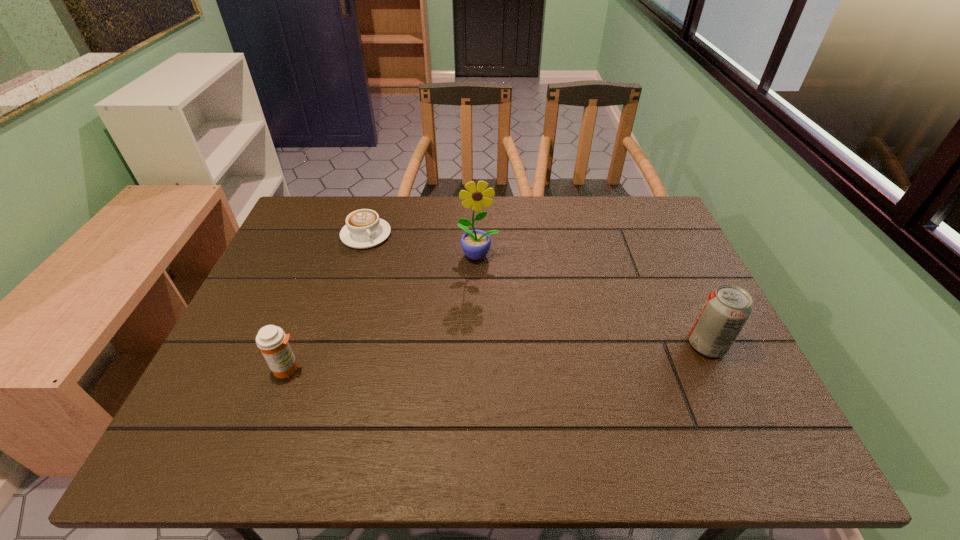
In order to click on vacant region at the near edge in this screenshot , I will do `click(417, 392)`.

You are a GUI agent. You are given a task and a screenshot of the screen. Output one action in this format:
    pyautogui.click(x=<x>, y=<y>)
    Task: Click on the free space at the left edge
    The width and height of the screenshot is (960, 540).
    Given the screenshot: What is the action you would take?
    pyautogui.click(x=289, y=326)

Identify the location of vacant position at the right edge of the desktop. The width and height of the screenshot is (960, 540). (704, 299).

The height and width of the screenshot is (540, 960). I want to click on vacant space at the far left corner of the desktop, so click(x=324, y=206).

Locate an element on the screen. The width and height of the screenshot is (960, 540). free space at the far right corner of the desktop is located at coordinates (617, 213).

I want to click on vacant area that lies between the soda can and the cappuccino, so click(x=537, y=289).

Locate an element on the screen. vacant area between the tallest object and the second shortest object is located at coordinates (383, 312).

This screenshot has height=540, width=960. What are the coordinates of `vacant space that is in between the soda can and the cappuccino` in the screenshot? It's located at (537, 289).

Find the location of `free area in between the third object from left to right and the shortest object`. free area in between the third object from left to right and the shortest object is located at coordinates click(422, 245).

Locate an element on the screen. empty space between the sunflower and the soda can is located at coordinates (592, 300).